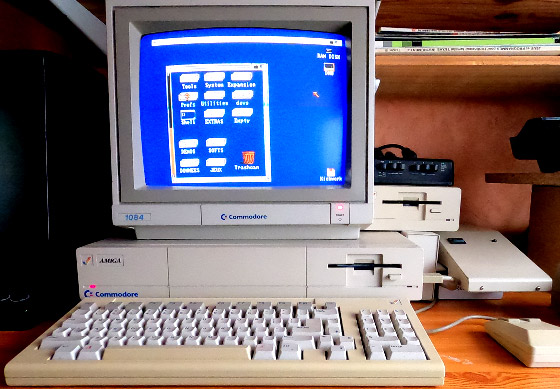
At what (x,y) coordinates should I click in order to perform the action: click on magazine. Please return your answer as a coordinate pair (x, y). The image size is (560, 389). Looking at the image, I should click on (486, 53).